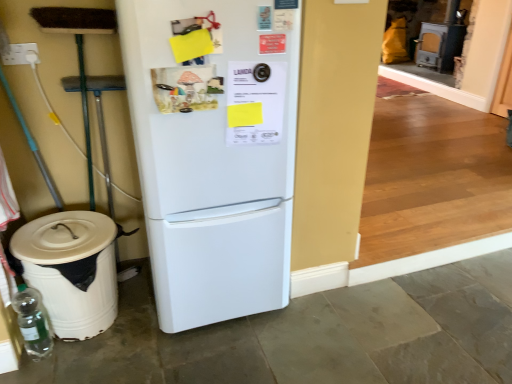
What do you see at coordinates (33, 322) in the screenshot?
I see `transparent glass bottle at lower left` at bounding box center [33, 322].

What do you see at coordinates (216, 160) in the screenshot? The width and height of the screenshot is (512, 384). I see `white matte refrigerator at center` at bounding box center [216, 160].

Where is `transparent glass bottle at lower left`? The height and width of the screenshot is (384, 512). transparent glass bottle at lower left is located at coordinates (33, 322).

Is white plastic trash bin at lower left positioned with its back to transparent glass bottle at lower left?

No.

Can you confirm if white plastic trash bin at lower left is positioned to the left of transparent glass bottle at lower left?

No, white plastic trash bin at lower left is not to the left of transparent glass bottle at lower left.

What are the coordinates of `bottle below the white plastic trash bin at lower left (from the image's perspective)` in the screenshot? It's located at (33, 322).

Between transparent glass bottle at lower left and white matte refrigerator at center, which one has less height?

With less height is transparent glass bottle at lower left.

Can we say transparent glass bottle at lower left lies outside white matte refrigerator at center?

Yes, transparent glass bottle at lower left is outside of white matte refrigerator at center.

This screenshot has height=384, width=512. I want to click on trash bin/can lying on the left of white matte refrigerator at center, so click(71, 270).

Is white plastic trash bin at lower left positioned far away from white matte refrigerator at center?

No, white plastic trash bin at lower left is not far away from white matte refrigerator at center.

Which point is more distant from viewer, (110, 250) or (265, 25)?

The point (110, 250) is behind.

Considering the sizes of white plastic trash bin at lower left and white matte refrigerator at center in the image, is white plastic trash bin at lower left taller or shorter than white matte refrigerator at center?

In the image, white plastic trash bin at lower left appears to be shorter than white matte refrigerator at center.

Consider the image. Does white matte refrigerator at center appear on the right side of transparent glass bottle at lower left?

Yes, white matte refrigerator at center is to the right of transparent glass bottle at lower left.

From the image's perspective, is white matte refrigerator at center above or below transparent glass bottle at lower left?

white matte refrigerator at center is above transparent glass bottle at lower left.

Is white matte refrigerator at center positioned behind transparent glass bottle at lower left?

That is False.

Is white matte refrigerator at center facing away from transparent glass bottle at lower left?

No, white matte refrigerator at center is not facing the opposite direction of transparent glass bottle at lower left.

Identify the location of trash bin/can behind the white matte refrigerator at center. This screenshot has width=512, height=384. (71, 270).

Considering the sizes of objects white matte refrigerator at center and white plastic trash bin at lower left in the image provided, who is wider, white matte refrigerator at center or white plastic trash bin at lower left?

With larger width is white matte refrigerator at center.

Is the surface of white matte refrigerator at center in direct contact with white plastic trash bin at lower left?

There is a gap between white matte refrigerator at center and white plastic trash bin at lower left.

Consider the image. Can you see transparent glass bottle at lower left touching white plastic trash bin at lower left?

No.

Which is in front, transparent glass bottle at lower left or white plastic trash bin at lower left?

white plastic trash bin at lower left is more forward.

Can you confirm if transparent glass bottle at lower left is wider than white plastic trash bin at lower left?

In fact, transparent glass bottle at lower left might be narrower than white plastic trash bin at lower left.

In the image, there is a white plastic trash bin at lower left. Where is `bottle below it (from a real-world perspective)`? The height and width of the screenshot is (384, 512). bottle below it (from a real-world perspective) is located at coordinates [33, 322].

The height and width of the screenshot is (384, 512). Find the location of `refrigerator on the right side of transparent glass bottle at lower left`. refrigerator on the right side of transparent glass bottle at lower left is located at coordinates (216, 160).

Considering their positions, is white plastic trash bin at lower left positioned further to transparent glass bottle at lower left than white matte refrigerator at center?

Based on the image, white matte refrigerator at center appears to be further to transparent glass bottle at lower left.

Considering their positions, is white matte refrigerator at center positioned further to white plastic trash bin at lower left than transparent glass bottle at lower left?

Among the two, white matte refrigerator at center is located further to white plastic trash bin at lower left.

From the image, which object appears to be farther from white matte refrigerator at center, white plastic trash bin at lower left or transparent glass bottle at lower left?

Among the two, transparent glass bottle at lower left is located further to white matte refrigerator at center.

Based on their spatial positions, is transparent glass bottle at lower left or white matte refrigerator at center further from white plastic trash bin at lower left?

The object further to white plastic trash bin at lower left is white matte refrigerator at center.

Considering their positions, is white matte refrigerator at center positioned closer to transparent glass bottle at lower left than white plastic trash bin at lower left?

The object closer to transparent glass bottle at lower left is white plastic trash bin at lower left.

Considering their positions, is transparent glass bottle at lower left positioned closer to white matte refrigerator at center than white plastic trash bin at lower left?

white plastic trash bin at lower left is closer to white matte refrigerator at center.

The image size is (512, 384). What are the coordinates of `trash bin/can situated between transparent glass bottle at lower left and white matte refrigerator at center from left to right` in the screenshot? It's located at (71, 270).